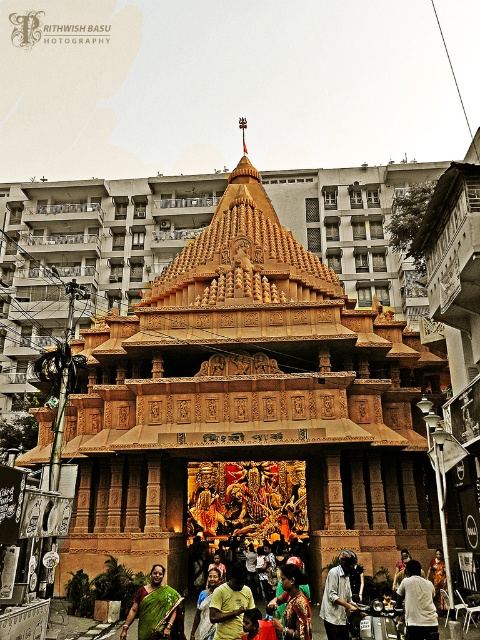
From the picture: You are standing in front of the temple and see a white cotton shirt at lower right and a white fabric dress at lower center. Which clothing item is closer to you?

The white cotton shirt at lower right is closer to you because it is further to the viewer than the white fabric dress at lower center.

You are standing in front of the temple and notice two points marked on the facade. The first point is at coordinates point (x=421, y=612) and the second is at point (x=207, y=589). Which point is nearer to your eyes?

Point (x=421, y=612) is closer to the camera than point (x=207, y=589), so the first point is nearer to your eyes.

Consider the image. You are standing at the entrance of the temple and want to take a photo of the golden dome at its apex. There is a person wearing a white cotton shirt at lower right in your view. Where should you position yourself to avoid the person blocking the dome in your photo?

To avoid the person wearing the white cotton shirt at lower right blocking the golden dome at its apex, position yourself to the left side of the scene, as the person is located at point (418, 604) which is towards the lower right corner. This will allow the golden dome at its apex to be centered in your view while keeping the person out of frame.